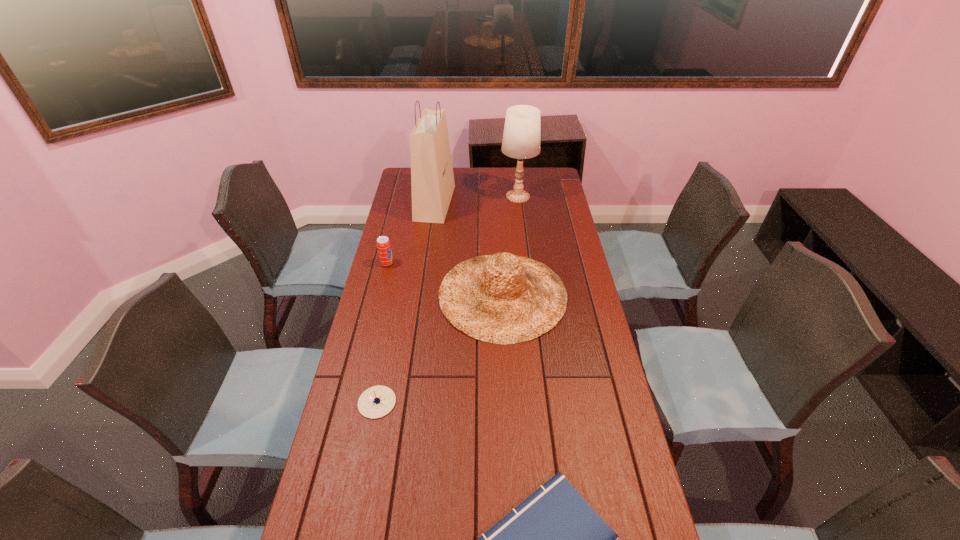
Find the location of `vacant point that satisfies the following two spatial constraints: 1. on the front side of the compass; 2. on the left side of the soda can`. vacant point that satisfies the following two spatial constraints: 1. on the front side of the compass; 2. on the left side of the soda can is located at coordinates (353, 402).

This screenshot has width=960, height=540. Find the location of `vacant space that satisfies the following two spatial constraints: 1. on the back side of the fifth farthest object; 2. on the left side of the fourth shortest object`. vacant space that satisfies the following two spatial constraints: 1. on the back side of the fifth farthest object; 2. on the left side of the fourth shortest object is located at coordinates (398, 295).